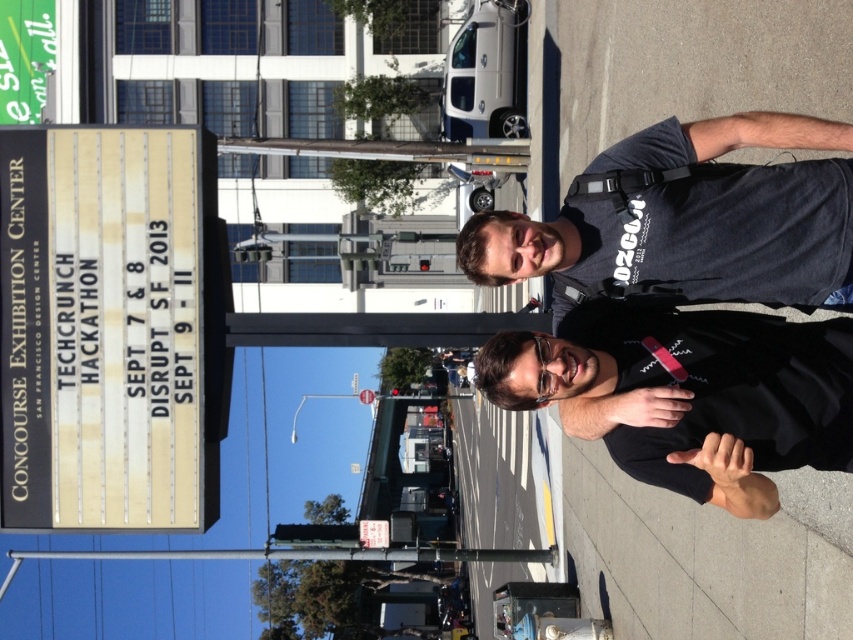
Question: Which point is closer to the camera?

Choices:
 (A) (724, 428)
 (B) (753, 276)

Answer: (A)

Question: Which point appears farthest from the camera in this image?

Choices:
 (A) (599, 349)
 (B) (473, 241)

Answer: (B)

Question: Is dark gray t-shirt at center to the right of black matte shirt at center from the viewer's perspective?

Choices:
 (A) yes
 (B) no

Answer: (A)

Question: Which object is farther from the camera taking this photo?

Choices:
 (A) dark gray t-shirt at center
 (B) black matte shirt at center

Answer: (B)

Question: Is dark gray t-shirt at center thinner than black matte shirt at center?

Choices:
 (A) no
 (B) yes

Answer: (A)

Question: Does dark gray t-shirt at center have a smaller size compared to black matte shirt at center?

Choices:
 (A) yes
 (B) no

Answer: (B)